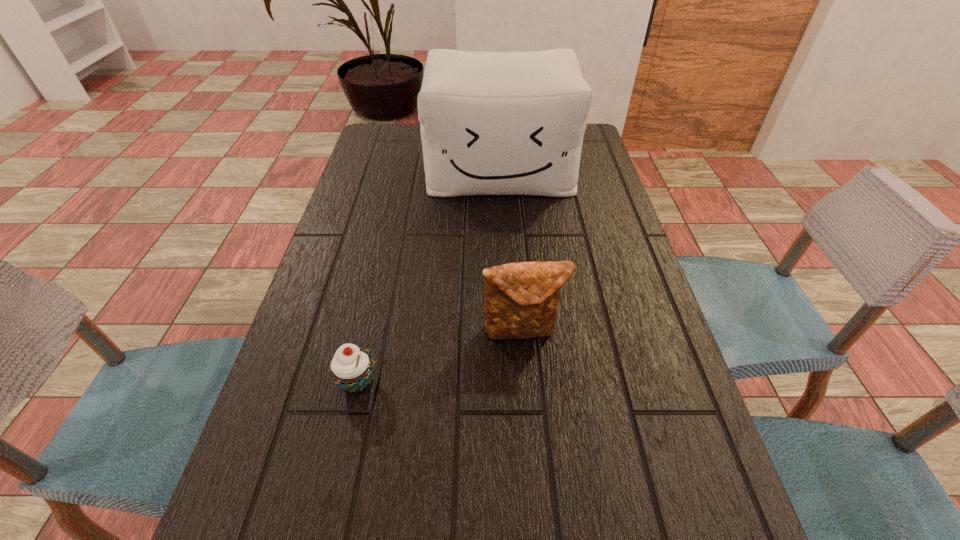
The image size is (960, 540). In order to click on the tallest object in this screenshot , I will do `click(492, 123)`.

I want to click on cushion, so pyautogui.click(x=492, y=123).

The width and height of the screenshot is (960, 540). Identify the location of the second tallest object. (521, 301).

Where is `clutch bag`? clutch bag is located at coordinates (521, 301).

Find the location of a particular element. the shortest object is located at coordinates (351, 367).

In order to click on cupcake in this screenshot , I will do (351, 367).

Where is `free space located 0.360m on the side of the cushion with the smiley face`? This screenshot has height=540, width=960. free space located 0.360m on the side of the cushion with the smiley face is located at coordinates (509, 299).

The image size is (960, 540). What are the coordinates of `vacant space positioned on the open side of the clutch bag` in the screenshot? It's located at pyautogui.click(x=536, y=481).

Find the location of `vacant point located 0.270m on the right of the shortest object`. vacant point located 0.270m on the right of the shortest object is located at coordinates (528, 382).

The height and width of the screenshot is (540, 960). I want to click on object present at the far edge, so [492, 123].